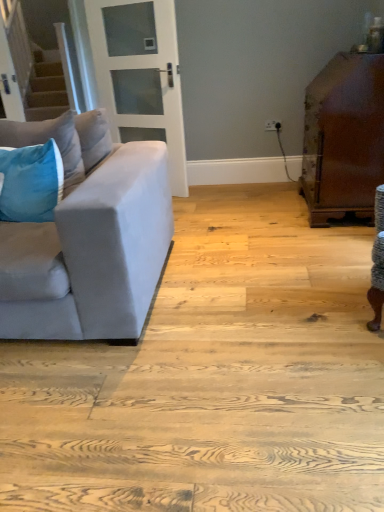
Find the location of a particular element. Image resolution: width=384 pixels, height=512 pixels. white glass door at upper center is located at coordinates pyautogui.click(x=140, y=75).

This screenshot has width=384, height=512. What do you see at coordinates (343, 138) in the screenshot?
I see `glossy brown wooden cabinet at right` at bounding box center [343, 138].

Find the location of a particular element. The image size is (384, 512). velvet blue pillow at left, the 2th pillow in the bottom-to-top sequence is located at coordinates (47, 140).

The image size is (384, 512). Find the location of `door behind the glossy brown wooden cabinet at right`. door behind the glossy brown wooden cabinet at right is located at coordinates (140, 75).

Between glossy brown wooden cabinet at right and white glass door at upper center, which one has smaller size?

white glass door at upper center is smaller.

Is glossy brown wooden cabinet at right far away from white glass door at upper center?

That's right, there is a large distance between glossy brown wooden cabinet at right and white glass door at upper center.

Measure the distance from glossy brown wooden cabinet at right to white glass door at upper center.

glossy brown wooden cabinet at right is 1.32 meters away from white glass door at upper center.

Looking at their sizes, would you say suede gray couch at left is wider or thinner than glossy brown wooden cabinet at right?

suede gray couch at left is wider than glossy brown wooden cabinet at right.

Which is more to the left, suede gray couch at left or glossy brown wooden cabinet at right?

Positioned to the left is suede gray couch at left.

Considering the sizes of objects suede gray couch at left and glossy brown wooden cabinet at right in the image provided, who is smaller, suede gray couch at left or glossy brown wooden cabinet at right?

glossy brown wooden cabinet at right is smaller.

Can you tell me how much suede gray couch at left and glossy brown wooden cabinet at right differ in facing direction?

suede gray couch at left and glossy brown wooden cabinet at right are facing 180 degrees away from each other.

Considering the relative positions of velvet blue pillow at left, which is the second pillow in top-to-bottom order, and velvet blue pillow at left, the first pillow viewed from the top, in the image provided, is velvet blue pillow at left, which is the second pillow in top-to-bottom order, in front of velvet blue pillow at left, the first pillow viewed from the top,?

Yes, velvet blue pillow at left, which is the second pillow in top-to-bottom order, is closer to the viewer.

Considering the relative positions of velvet blue pillow at left, arranged as the first pillow when ordered from the bottom, and velvet blue pillow at left, the first pillow viewed from the top, in the image provided, is velvet blue pillow at left, arranged as the first pillow when ordered from the bottom, to the right of velvet blue pillow at left, the first pillow viewed from the top, from the viewer's perspective?

Incorrect, velvet blue pillow at left, arranged as the first pillow when ordered from the bottom, is not on the right side of velvet blue pillow at left, the first pillow viewed from the top.

Which of these two, velvet blue pillow at left, which is the second pillow in top-to-bottom order, or velvet blue pillow at left, the first pillow viewed from the top, stands taller?

velvet blue pillow at left, the first pillow viewed from the top, is taller.

From the image's perspective, is velvet blue pillow at left, arranged as the first pillow when ordered from the bottom, over velvet blue pillow at left, the 2th pillow in the bottom-to-top sequence?

No, from the image's perspective, velvet blue pillow at left, arranged as the first pillow when ordered from the bottom, is not over velvet blue pillow at left, the 2th pillow in the bottom-to-top sequence.

Who is more distant, glossy brown wooden cabinet at right or velvet blue pillow at left, which is the second pillow in top-to-bottom order?

glossy brown wooden cabinet at right is behind.

Is glossy brown wooden cabinet at right shorter than velvet blue pillow at left, which is the second pillow in top-to-bottom order?

Incorrect, the height of glossy brown wooden cabinet at right does not fall short of that of velvet blue pillow at left, which is the second pillow in top-to-bottom order.

Is glossy brown wooden cabinet at right placed right next to velvet blue pillow at left, which is the second pillow in top-to-bottom order?

glossy brown wooden cabinet at right and velvet blue pillow at left, which is the second pillow in top-to-bottom order, are not in contact.

Measure the distance from glossy brown wooden cabinet at right to velvet blue pillow at left, arranged as the first pillow when ordered from the bottom.

glossy brown wooden cabinet at right is 1.68 meters from velvet blue pillow at left, arranged as the first pillow when ordered from the bottom.

Can you tell me how much white glass door at upper center and suede gray couch at left differ in facing direction?

The angle between the facing direction of white glass door at upper center and the facing direction of suede gray couch at left is 113 degrees.

Consider the image. Is the surface of white glass door at upper center in direct contact with suede gray couch at left?

No, white glass door at upper center is not with suede gray couch at left.

Which of these two, white glass door at upper center or suede gray couch at left, is wider?

With larger width is suede gray couch at left.

How far apart are velvet blue pillow at left, the 2th pillow in the bottom-to-top sequence, and velvet blue pillow at left, which is the second pillow in top-to-bottom order?

They are 13.07 centimeters apart.

Is point (51, 123) closer or farther from the camera than point (27, 207)?

Point (51, 123) is farther from the camera than point (27, 207).

Could you tell me if velvet blue pillow at left, the 2th pillow in the bottom-to-top sequence, is turned towards velvet blue pillow at left, arranged as the first pillow when ordered from the bottom?

Yes, velvet blue pillow at left, the 2th pillow in the bottom-to-top sequence, faces towards velvet blue pillow at left, arranged as the first pillow when ordered from the bottom.

Who is smaller, velvet blue pillow at left, the first pillow viewed from the top, or velvet blue pillow at left, arranged as the first pillow when ordered from the bottom?

Smaller between the two is velvet blue pillow at left, arranged as the first pillow when ordered from the bottom.

Based on the photo, who is smaller, suede gray couch at left or velvet blue pillow at left, which is the second pillow in top-to-bottom order?

Smaller between the two is velvet blue pillow at left, which is the second pillow in top-to-bottom order.

Between point (105, 236) and point (49, 191), which one is positioned behind?

The point (49, 191) is farther.

Does suede gray couch at left have a lesser height compared to velvet blue pillow at left, which is the second pillow in top-to-bottom order?

No, suede gray couch at left is not shorter than velvet blue pillow at left, which is the second pillow in top-to-bottom order.

Is suede gray couch at left to the left or to the right of velvet blue pillow at left, which is the second pillow in top-to-bottom order, in the image?

Based on their positions, suede gray couch at left is located to the right of velvet blue pillow at left, which is the second pillow in top-to-bottom order.

There is a glossy brown wooden cabinet at right. Where is `door above it (from a real-world perspective)`? door above it (from a real-world perspective) is located at coordinates (140, 75).

I want to click on studio couch below the glossy brown wooden cabinet at right (from the image's perspective), so coord(87,236).

Looking at the image, which one is located further to velvet blue pillow at left, the first pillow viewed from the top, white glass door at upper center or suede gray couch at left?

The object further to velvet blue pillow at left, the first pillow viewed from the top, is white glass door at upper center.

Looking at the image, which one is located further to velvet blue pillow at left, which is the second pillow in top-to-bottom order, suede gray couch at left or white glass door at upper center?

white glass door at upper center is further to velvet blue pillow at left, which is the second pillow in top-to-bottom order.

When comparing their distances from velvet blue pillow at left, arranged as the first pillow when ordered from the bottom, does glossy brown wooden cabinet at right or white glass door at upper center seem further?

Among the two, glossy brown wooden cabinet at right is located further to velvet blue pillow at left, arranged as the first pillow when ordered from the bottom.

Based on their spatial positions, is velvet blue pillow at left, the 2th pillow in the bottom-to-top sequence, or suede gray couch at left closer to velvet blue pillow at left, arranged as the first pillow when ordered from the bottom?

velvet blue pillow at left, the 2th pillow in the bottom-to-top sequence, is positioned closer to the anchor velvet blue pillow at left, arranged as the first pillow when ordered from the bottom.

Based on their spatial positions, is velvet blue pillow at left, arranged as the first pillow when ordered from the bottom, or suede gray couch at left closer to white glass door at upper center?

The object closer to white glass door at upper center is suede gray couch at left.

Estimate the real-world distances between objects in this image. Which object is closer to glossy brown wooden cabinet at right, suede gray couch at left or velvet blue pillow at left, arranged as the first pillow when ordered from the bottom?

suede gray couch at left is closer to glossy brown wooden cabinet at right.

Which object lies further to the anchor point suede gray couch at left, glossy brown wooden cabinet at right or velvet blue pillow at left, which is the second pillow in top-to-bottom order?

The object further to suede gray couch at left is glossy brown wooden cabinet at right.

Based on their spatial positions, is velvet blue pillow at left, the 2th pillow in the bottom-to-top sequence, or velvet blue pillow at left, which is the second pillow in top-to-bottom order, further from white glass door at upper center?

Among the two, velvet blue pillow at left, which is the second pillow in top-to-bottom order, is located further to white glass door at upper center.

Locate an element on the screen. door between velvet blue pillow at left, arranged as the first pillow when ordered from the bottom, and glossy brown wooden cabinet at right is located at coordinates (140, 75).

Locate an element on the screen. pillow between suede gray couch at left and velvet blue pillow at left, the first pillow viewed from the top, along the z-axis is located at coordinates (31, 182).

What are the coordinates of `studio couch between velvet blue pillow at left, the 2th pillow in the bottom-to-top sequence, and glossy brown wooden cabinet at right, in the horizontal direction` in the screenshot? It's located at (87, 236).

Locate an element on the screen. pillow between velvet blue pillow at left, arranged as the first pillow when ordered from the bottom, and white glass door at upper center from front to back is located at coordinates (47, 140).